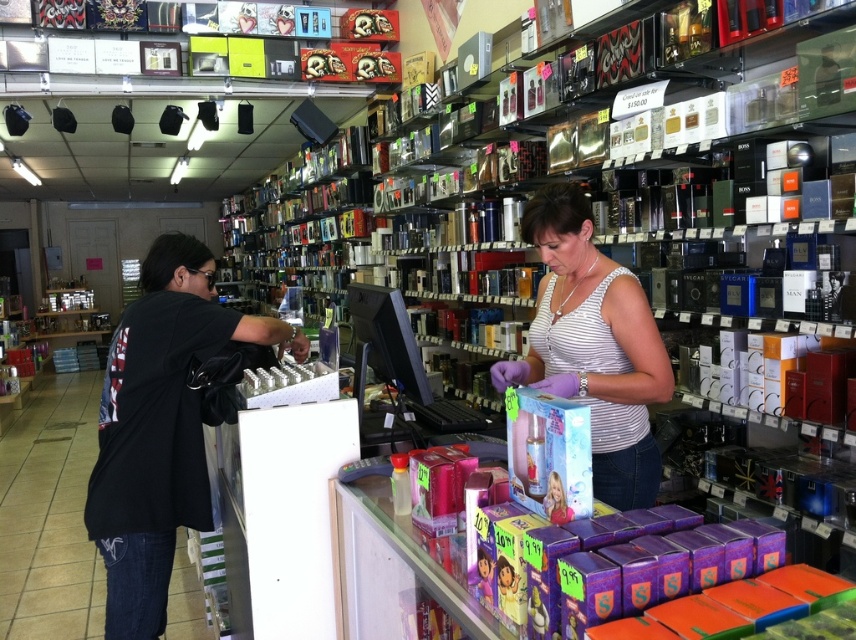
Locate an element on the screen. The image size is (856, 640). white striped tank top at center is located at coordinates (593, 346).

Who is more distant from viewer, (599, 426) or (131, 332)?

Positioned behind is point (131, 332).

You are a GUI agent. You are given a task and a screenshot of the screen. Output one action in this format:
    pyautogui.click(x=<x>, y=<y>)
    Task: Click on the white striped tank top at center
    
    Given the screenshot: What is the action you would take?
    pyautogui.click(x=593, y=346)